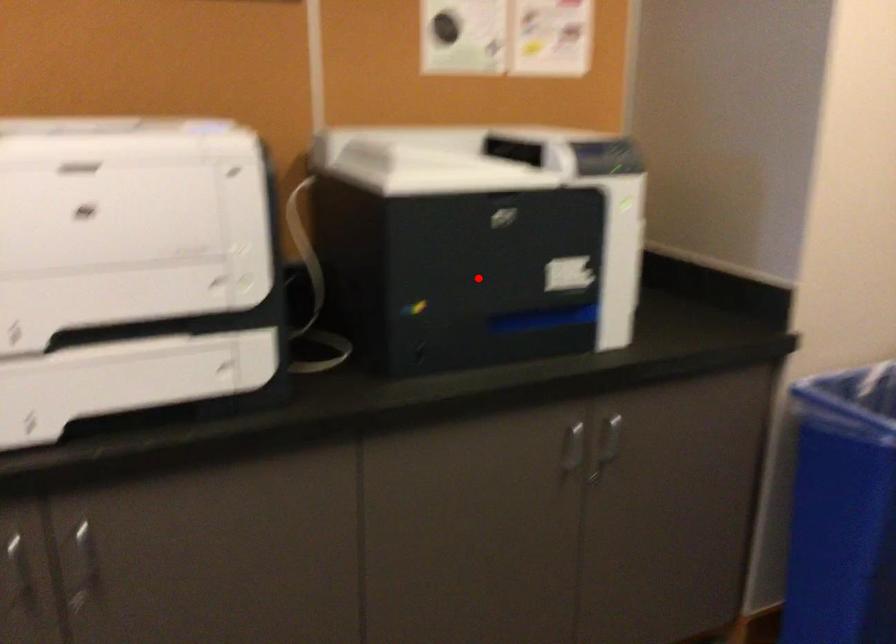
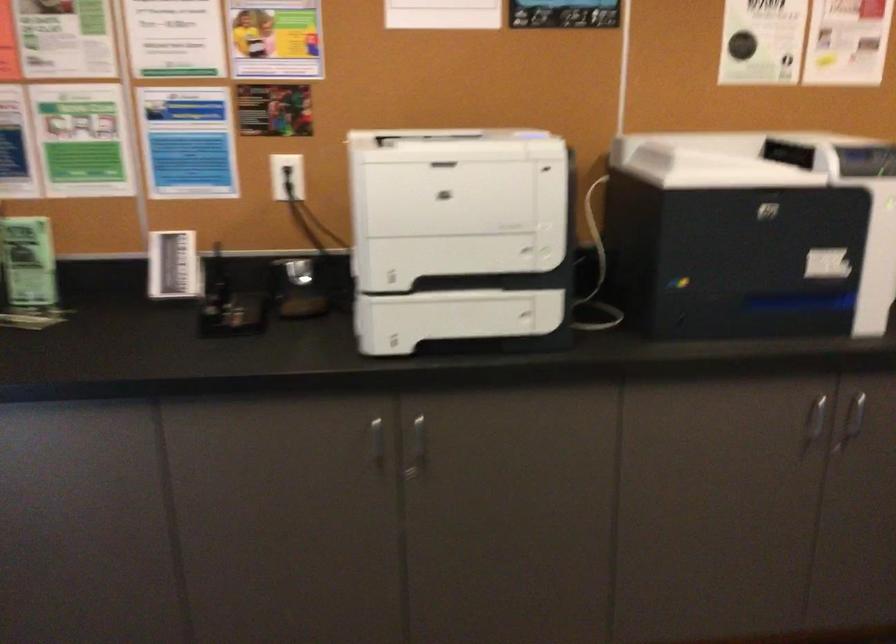
Question: A red point is marked in image1. In image2, is the corresponding 3D point closer to the camera or farther? Reply with the corresponding letter.

Choices:
 (A) The corresponding 3D point is closer.
 (B) The corresponding 3D point is farther.

Answer: (B)